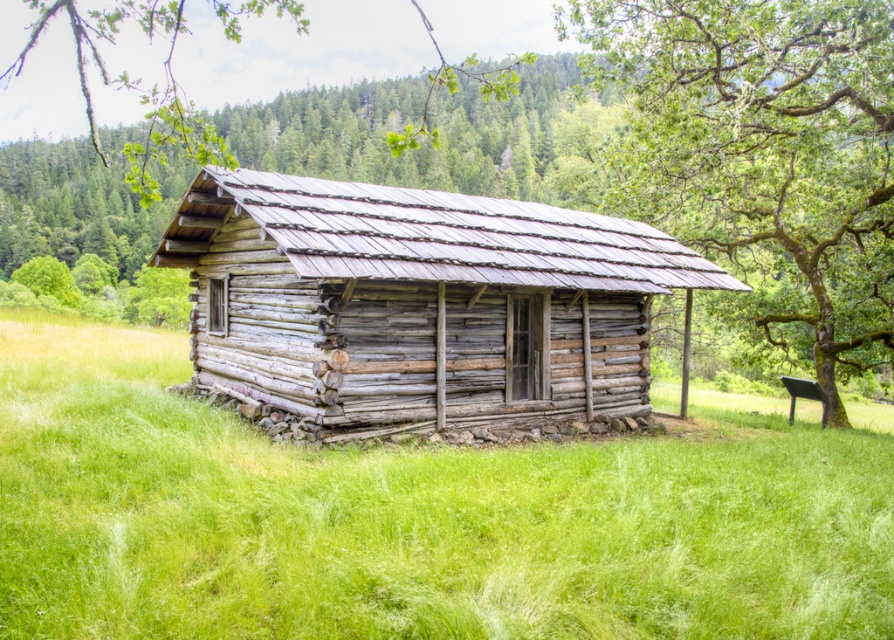
Question: Which of the following is the closest to the observer?

Choices:
 (A) click(637, 8)
 (B) click(65, 582)
 (C) click(457, 198)

Answer: (B)

Question: Which of the following is the farthest from the observer?

Choices:
 (A) green grassy field at center
 (B) green mossy bark tree at upper right
 (C) weathered wood cabin at center

Answer: (B)

Question: From the image, what is the correct spatial relationship of green grassy field at center in relation to green leafy tree at upper center?

Choices:
 (A) below
 (B) above

Answer: (A)

Question: Estimate the real-world distances between objects in this image. Which object is closer to the weathered wood cabin at center?

Choices:
 (A) green mossy bark tree at upper right
 (B) green grassy field at center

Answer: (B)

Question: Can you confirm if green grassy field at center is positioned to the right of green leafy tree at upper center?

Choices:
 (A) no
 (B) yes

Answer: (B)

Question: Does weathered wood cabin at center have a smaller size compared to green mossy bark tree at upper right?

Choices:
 (A) no
 (B) yes

Answer: (B)